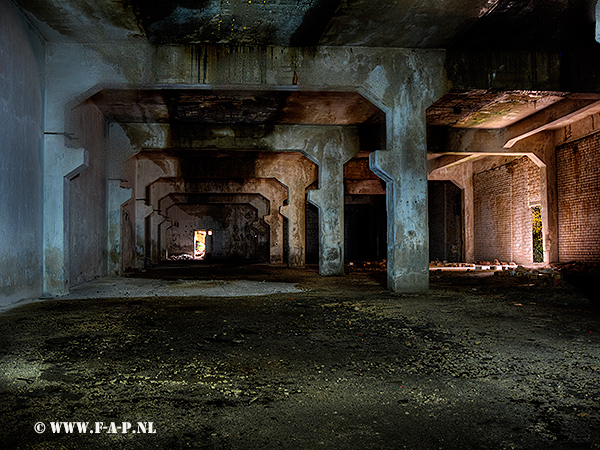
Identify the location of wall. The width and height of the screenshot is (600, 450). point(22,182), point(84,216), point(128,230), point(586,206), point(491,190), point(442,221), point(352,225), point(307,234).